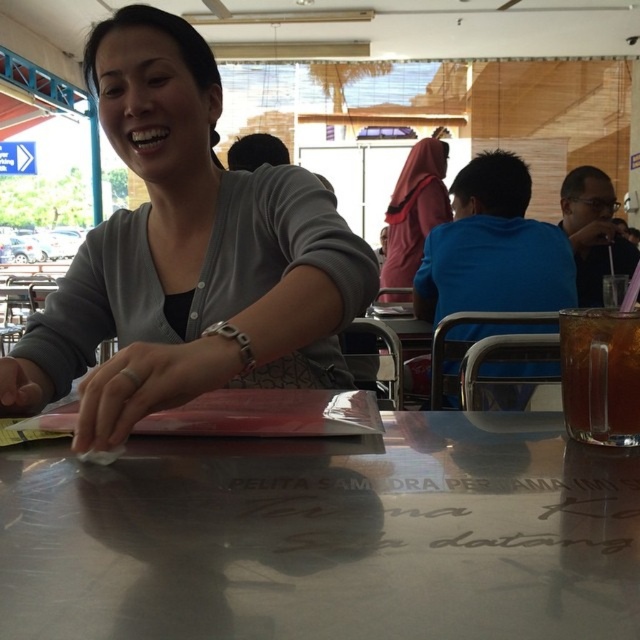
Question: Can you confirm if matte gray cardigan at center is positioned below translucent glass cup at lower right?

Choices:
 (A) yes
 (B) no

Answer: (B)

Question: Which point appears closest to the camera in this image?

Choices:
 (A) (228, 460)
 (B) (570, 384)
 (C) (291, 221)
 (D) (397, 225)

Answer: (A)

Question: Is metallic silver table at center behind translucent glass cup at lower right?

Choices:
 (A) no
 (B) yes

Answer: (A)

Question: Considering the real-world distances, which object is farthest from the matte pink hijab at center?

Choices:
 (A) translucent glass cup at lower right
 (B) matte gray cardigan at center

Answer: (A)

Question: Where is metallic silver table at center located in relation to matte gray cardigan at center in the image?

Choices:
 (A) right
 (B) left

Answer: (A)

Question: Estimate the real-world distances between objects in this image. Which object is farther from the matte pink hijab at center?

Choices:
 (A) matte gray cardigan at center
 (B) metallic silver table at center

Answer: (B)